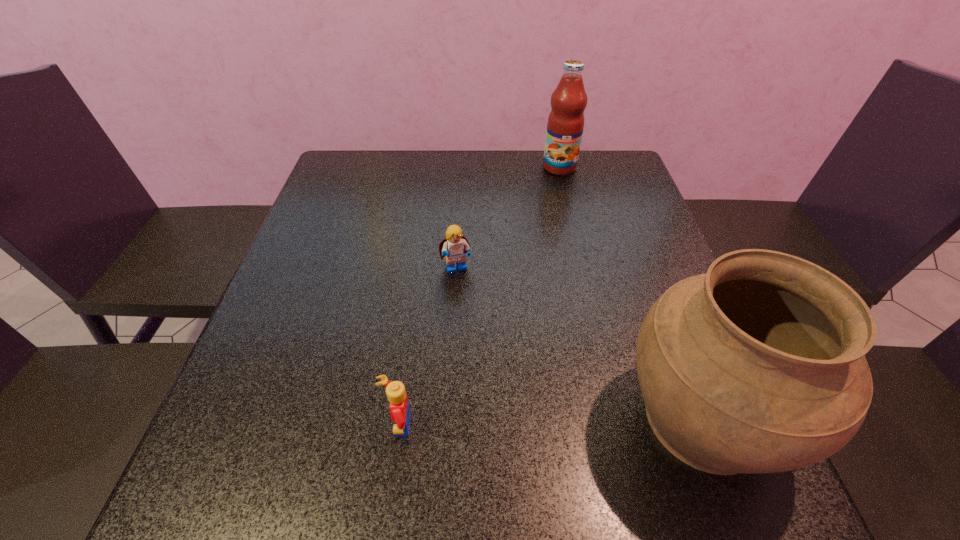
Locate an element on the screen. vacant point located on the front-facing side of the farther Lego is located at coordinates (496, 383).

Find the location of a particular element. free space located on the front-facing side of the farther Lego is located at coordinates (486, 352).

Identify the location of free region located on the front-facing side of the farther Lego. (511, 422).

Where is `vacant space situated on the front label of the farthest object`? This screenshot has height=540, width=960. vacant space situated on the front label of the farthest object is located at coordinates (559, 209).

The width and height of the screenshot is (960, 540). Identify the location of vacant space located 0.280m on the front label of the farthest object. (558, 238).

This screenshot has height=540, width=960. In order to click on vacant area located 0.080m on the front label of the farthest object in this screenshot , I will do `click(559, 192)`.

Where is `object situated at the far edge`? The width and height of the screenshot is (960, 540). object situated at the far edge is located at coordinates (565, 125).

The width and height of the screenshot is (960, 540). What are the coordinates of `Lego at the near edge` in the screenshot? It's located at (399, 406).

Where is `urn situated at the near edge`? The height and width of the screenshot is (540, 960). urn situated at the near edge is located at coordinates (758, 366).

At what (x,y) coordinates should I click in order to perform the action: click on urn located in the right edge section of the desktop. Please return your answer as a coordinate pair (x, y). Looking at the image, I should click on click(758, 366).